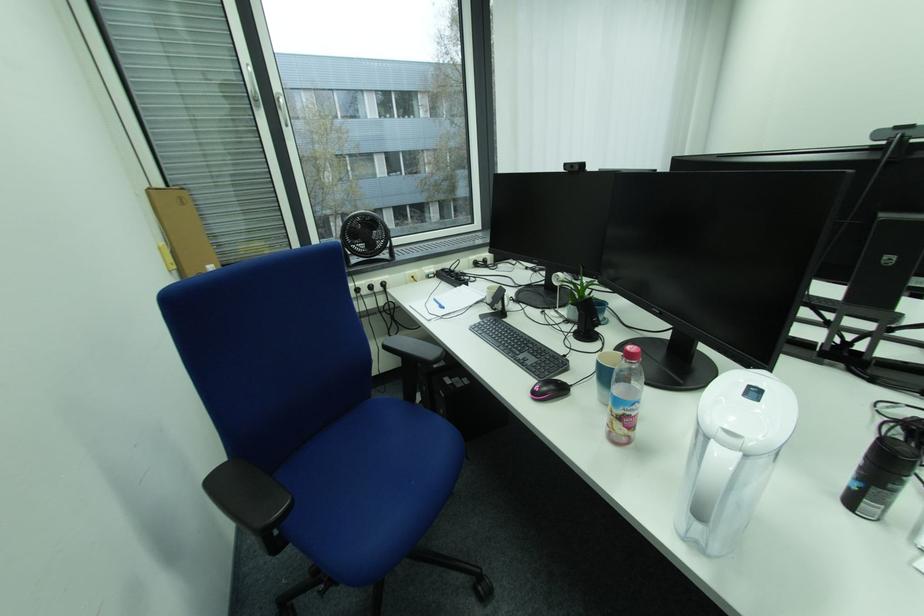
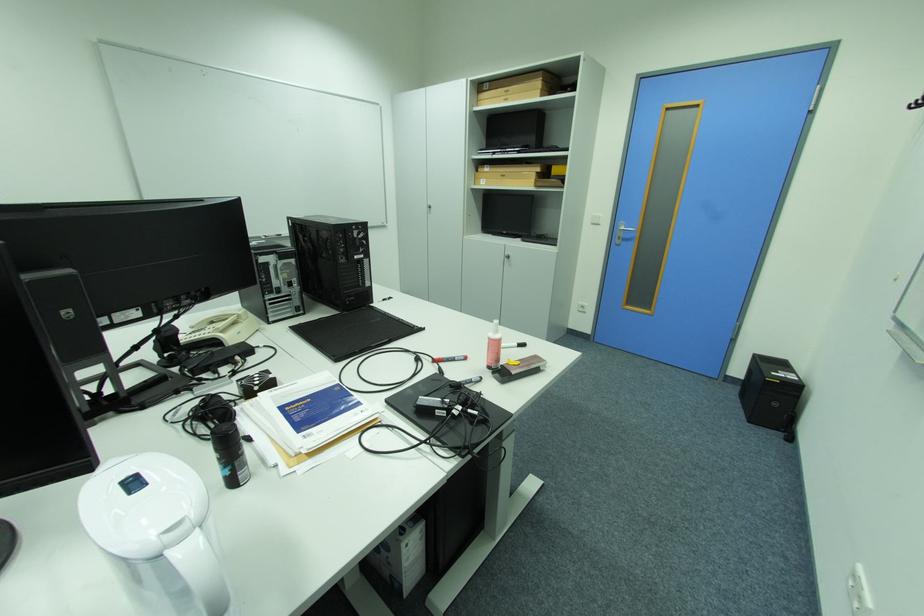
Locate, in the second image, the point that corresponds to [870,506] in the first image.

(247, 477)